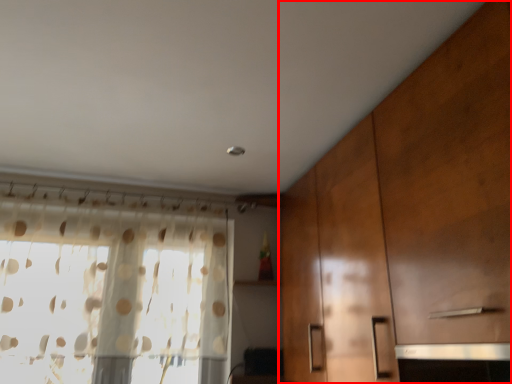
Question: From the image's perspective, where is cabinetry (annotated by the red box) located relative to window?

Choices:
 (A) above
 (B) below

Answer: (A)